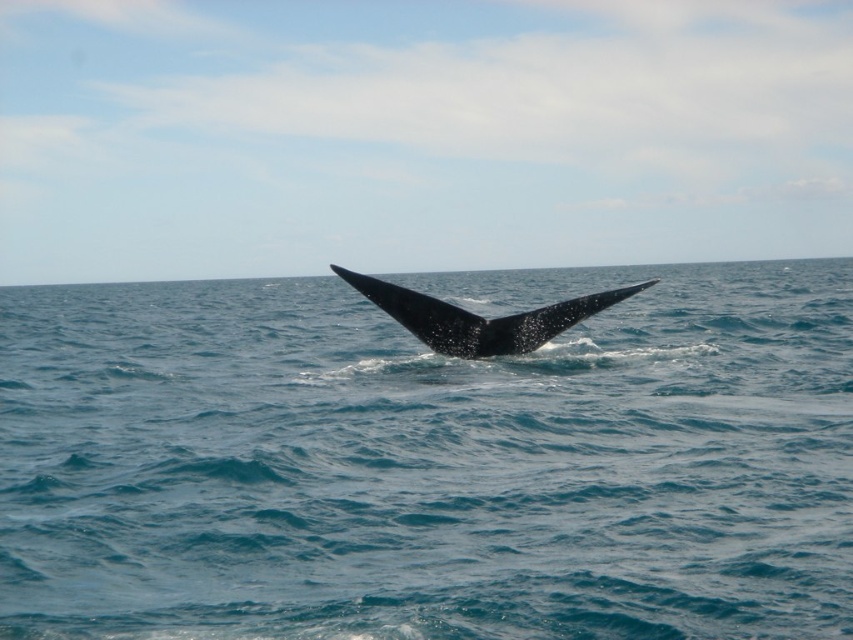
Does glossy blue water at center have a greater width compared to black matte whale tail at center?

Yes.

Does point (747, 557) lie behind point (422, 294)?

No, (747, 557) is closer to viewer.

Where is `glossy blue water at center`? glossy blue water at center is located at coordinates (428, 460).